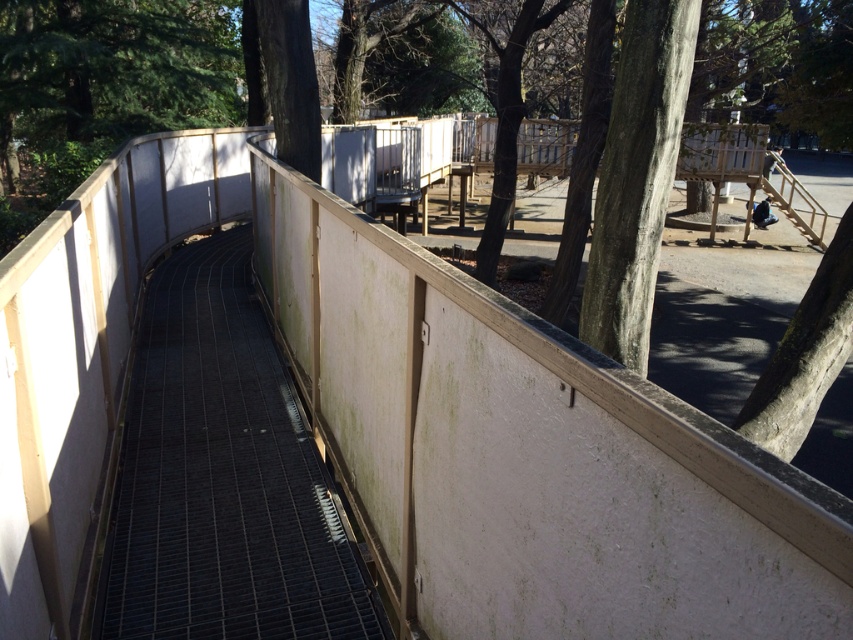
You are standing on the curved metal grating pathway bordered by a weathered beige wall with wooden supports. You notice two points marked on the pathway. One is at coordinate point [184,307] and the other at point [639,212]. Which point is closer to you as you stand facing the pathway?

Point [184,307] is closer to you because it is further to the viewer than point [639,212].